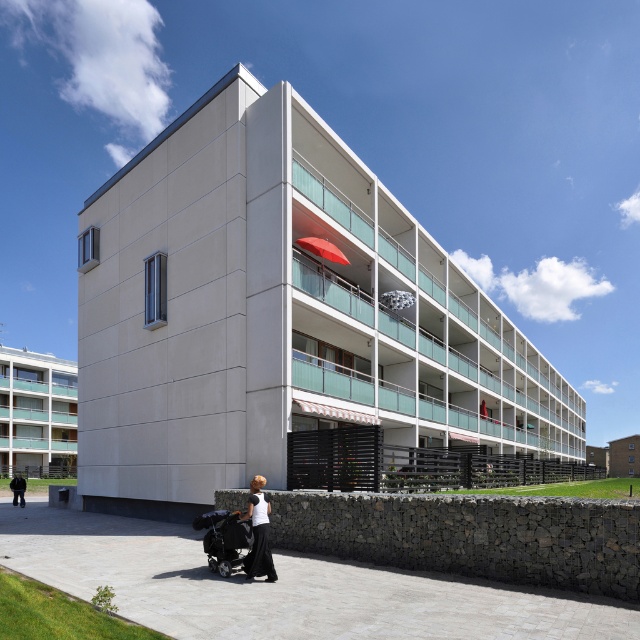
Question: Does black fabric baby carriage at lower center appear on the left side of black matte dress at lower center?

Choices:
 (A) yes
 (B) no

Answer: (A)

Question: Is the position of black matte dress at lower center more distant than that of black fabric at lower left?

Choices:
 (A) yes
 (B) no

Answer: (B)

Question: Which point appears closest to the camera in this image?

Choices:
 (A) (241, 531)
 (B) (268, 557)
 (C) (24, 481)

Answer: (B)

Question: Which of the following is the farthest from the observer?

Choices:
 (A) (248, 579)
 (B) (12, 480)

Answer: (B)

Question: Which point appears farthest from the camera in this image?

Choices:
 (A) (232, 564)
 (B) (253, 492)
 (C) (17, 476)

Answer: (C)

Question: Does black fabric baby carriage at lower center appear over black fabric at lower left?

Choices:
 (A) no
 (B) yes

Answer: (B)